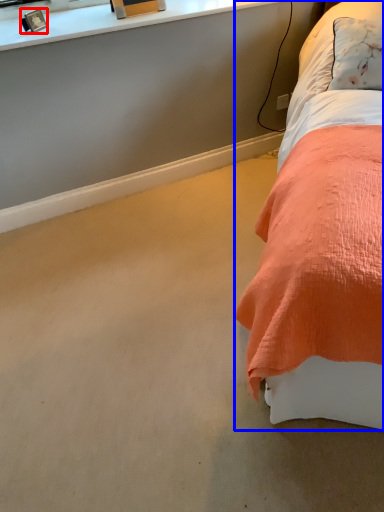
Question: Which point is further to the camera, picture frame (highlighted by a red box) or bed (highlighted by a blue box)?

Choices:
 (A) picture frame
 (B) bed

Answer: (A)